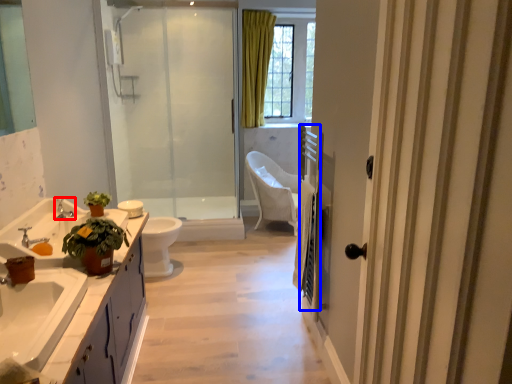
Question: Which object appears farthest to the camera in this image, tap (highlighted by a red box) or balustrade (highlighted by a blue box)?

Choices:
 (A) tap
 (B) balustrade

Answer: (A)